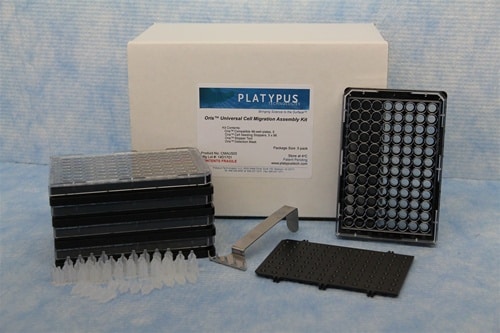
I want to click on holder, so click(x=419, y=130).